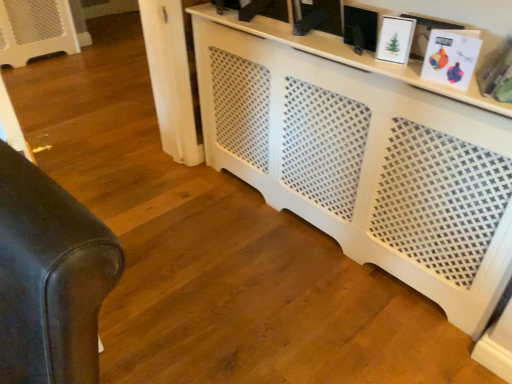
The image size is (512, 384). Find the location of `vacant area in front of matte black picture frame at upper center, which appears as the third picture frame when viewed from the right`. vacant area in front of matte black picture frame at upper center, which appears as the third picture frame when viewed from the right is located at coordinates (378, 64).